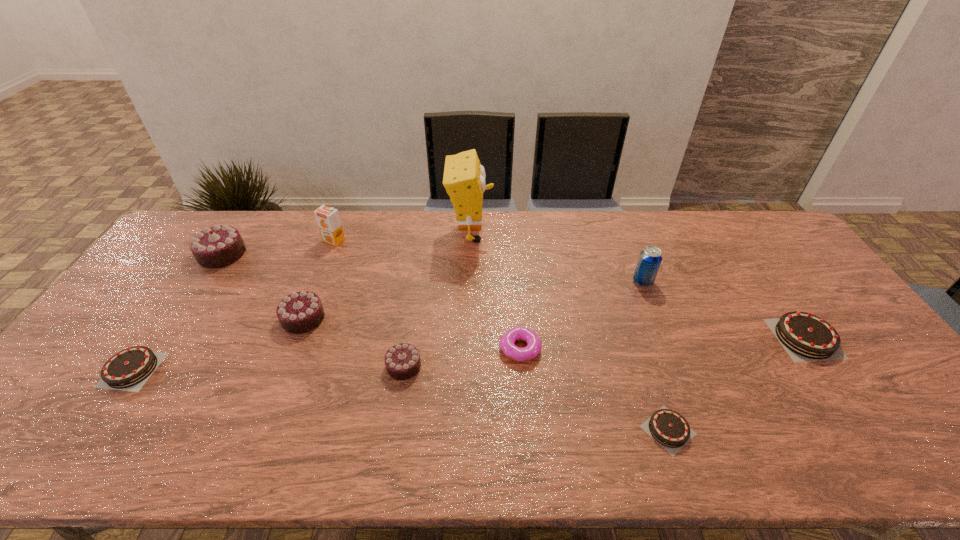
I want to click on free space that satisfies the following two spatial constraints: 1. on the front side of the second brown chocolate cake from left to right; 2. on the right side of the second shortest chocolate cake, so click(x=90, y=430).

You are a GUI agent. You are given a task and a screenshot of the screen. Output one action in this format:
    pyautogui.click(x=<x>, y=<y>)
    Task: Click on the vacant space that satisfies the following two spatial constraints: 1. on the front side of the orange orange juice; 2. on the left side of the pink doughnut
    This screenshot has width=960, height=540.
    Given the screenshot: What is the action you would take?
    pyautogui.click(x=292, y=349)